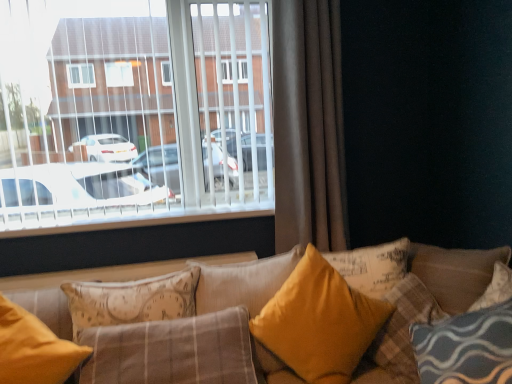
Question: Considering their positions, is white plastic blinds at upper left located in front of or behind velvet yellow pillow at center, the 2th pillow viewed from the right?

Choices:
 (A) behind
 (B) front

Answer: (A)

Question: Visually, is white plastic blinds at upper left positioned to the left or to the right of velvet yellow pillow at center, which appears as the fourth pillow when viewed from the left?

Choices:
 (A) right
 (B) left

Answer: (B)

Question: Considering the real-world distances, which object is closest to the velvet yellow pillow at center, which appears as the fourth pillow when viewed from the left?

Choices:
 (A) brown fabric curtain at right
 (B) velvet yellow pillow at center, the third pillow when ordered from right to left
 (C) matte yellow pillow at lower left, which appears as the first pillow when viewed from the left
 (D) white plastic blinds at upper left
 (E) yellow fabric pillow at center, which is the first pillow in right-to-left order

Answer: (E)

Question: Which object is the closest to the yellow fabric pillow at center, placed as the 5th pillow when sorted from left to right?

Choices:
 (A) white plastic blinds at upper left
 (B) velvet yellow pillow at center, which appears as the fourth pillow when viewed from the left
 (C) brown fabric curtain at right
 (D) yellow fabric pillow at center, which appears as the 2th pillow when viewed from the left
 (E) velvet yellow pillow at center, arranged as the 3th pillow when viewed from the left

Answer: (B)